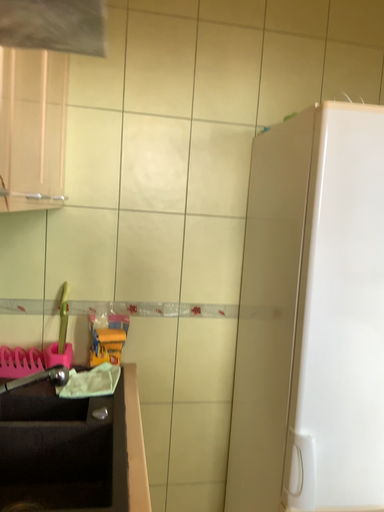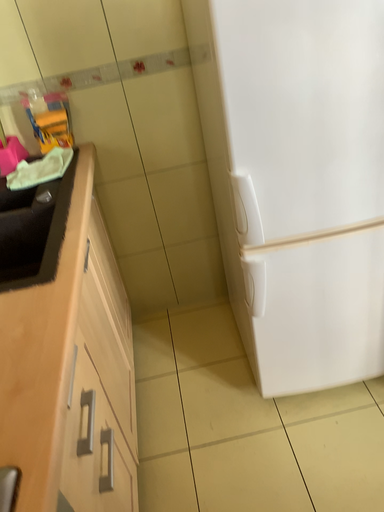
Question: How did the camera likely rotate when shooting the video?

Choices:
 (A) rotated downward
 (B) rotated upward

Answer: (A)